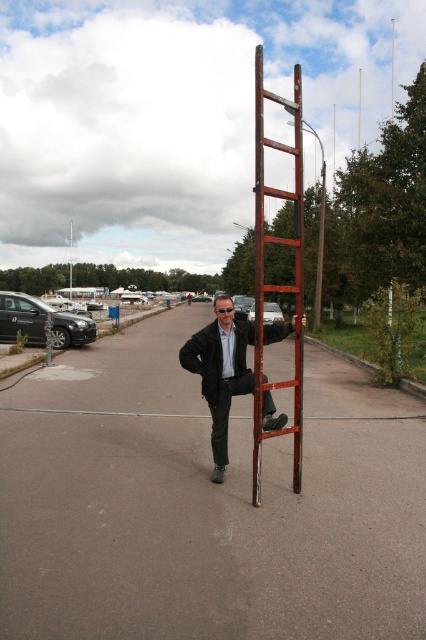
Is point (324, 621) less distant than point (219, 380)?

Yes.

Who is higher up, metallic gray parking lot at center or matte black suit at center?

Positioned higher is matte black suit at center.

Looking at this image, who is more distant from viewer, (9, 618) or (244, 348)?

Point (244, 348)

This screenshot has height=640, width=426. In order to click on metallic gray parking lot at center in this screenshot , I will do point(204,502).

Between rusty metal ladder at center and matte black suit at center, which one has less height?

With less height is matte black suit at center.

Describe the element at coordinates (262, 269) in the screenshot. I see `rusty metal ladder at center` at that location.

This screenshot has width=426, height=640. Find the location of `rusty metal ladder at center`. rusty metal ladder at center is located at coordinates (262, 269).

From the picture: Does metallic gray parking lot at center have a lesser height compared to rusty metal ladder at center?

Yes, metallic gray parking lot at center is shorter than rusty metal ladder at center.

Between metallic gray parking lot at center and rusty metal ladder at center, which one appears on the right side from the viewer's perspective?

rusty metal ladder at center is more to the right.

Between point (216, 556) and point (256, 150), which one is positioned behind?

The point (256, 150) is more distant.

Find the location of a particular element. Image resolution: width=426 pixels, height=640 pixels. metallic gray parking lot at center is located at coordinates (204, 502).